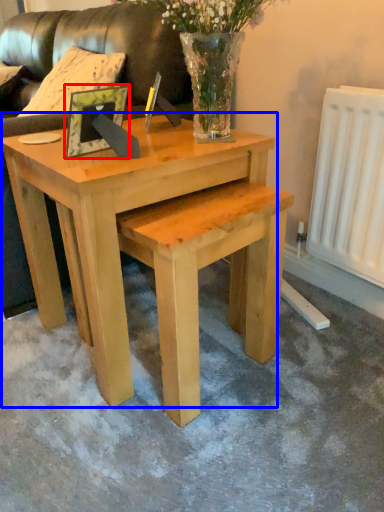
Question: Which of the following is the closest to the observer, picture frame (highlighted by a red box) or coffee table (highlighted by a blue box)?

Choices:
 (A) picture frame
 (B) coffee table

Answer: (B)